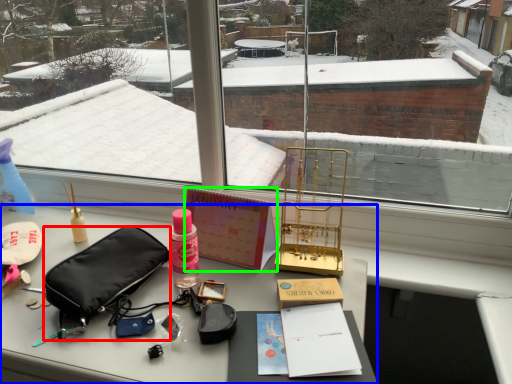
Question: Which object is positioned closest to handbag (highlighted by a red box)? Select from desk (highlighted by a blue box) and book (highlighted by a green box).

Choices:
 (A) desk
 (B) book

Answer: (A)